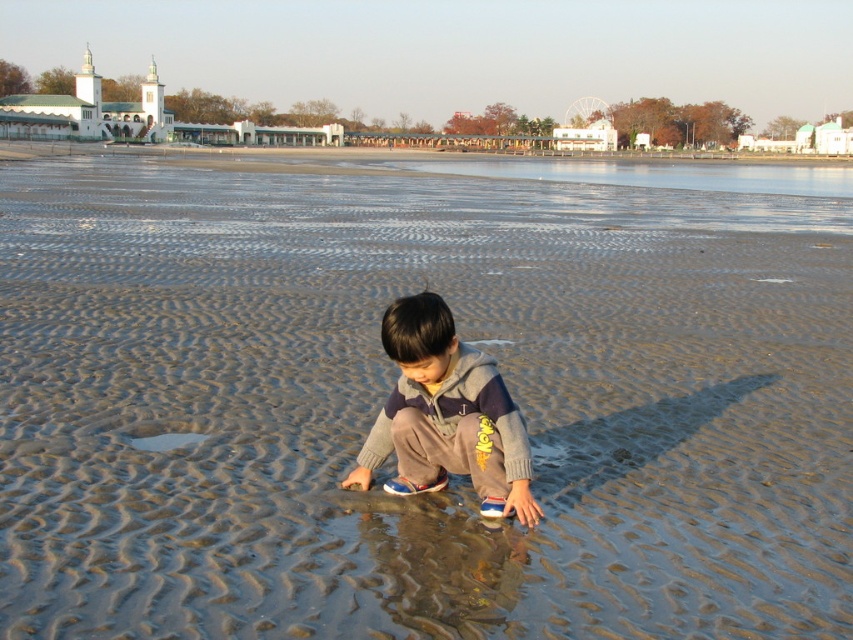
Measure the distance between point (442, 339) and camera.

Point (442, 339) and camera are 12.23 feet apart.

Image resolution: width=853 pixels, height=640 pixels. What are the coordinates of `gray fleece jacket at center` in the screenshot? It's located at (445, 416).

Between point (430, 292) and point (194, 436), which one is positioned behind?

The point (194, 436) is behind.

Where is `gray fleece jacket at center`? Image resolution: width=853 pixels, height=640 pixels. gray fleece jacket at center is located at coordinates (445, 416).

Looking at this image, between clear water at upper center and clear water at lower left, which one is positioned lower?

clear water at lower left is lower down.

Which is more to the left, clear water at upper center or clear water at lower left?

clear water at lower left

Where is `clear water at upper center`? The height and width of the screenshot is (640, 853). clear water at upper center is located at coordinates (659, 173).

The image size is (853, 640). Find the location of `clear water at upper center`. clear water at upper center is located at coordinates (659, 173).

Who is positioned more to the left, gray fleece jacket at center or clear water at upper center?

gray fleece jacket at center

Who is more forward, (502, 481) or (590, 172)?

Point (502, 481) is in front.

At what (x,y) coordinates should I click in order to perform the action: click on gray fleece jacket at center. Please return your answer as a coordinate pair (x, y). Looking at the image, I should click on (445, 416).